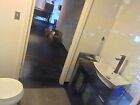
Point to any where you'd turn on the light in the image. Your answer should be formatted as a list of tuples, i.e. [(x1, y1), (x2, y2), ...], where each tuple contains the x and y coordinates of a point satisfying the conditions above.

[(17, 15)]